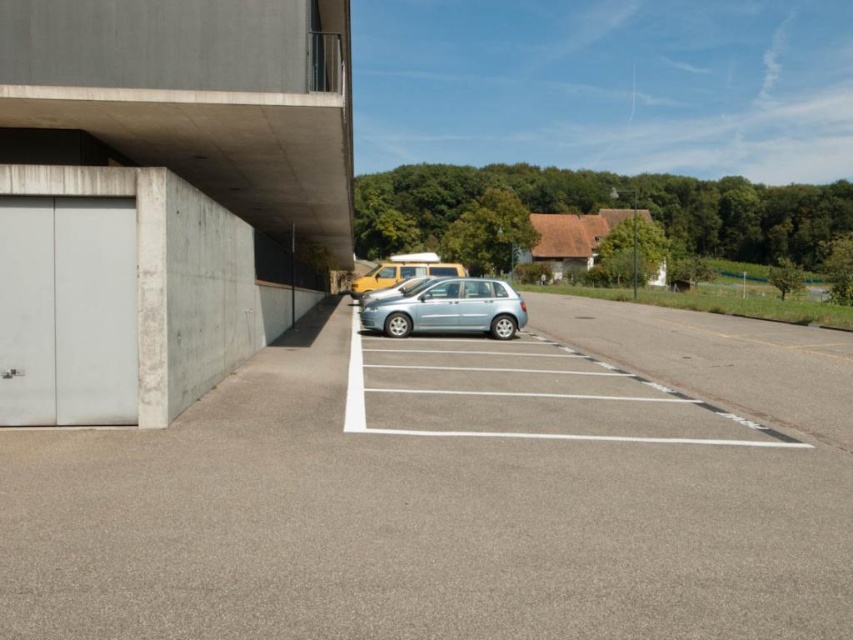
Between metallic yellow van at center and satin silver car at center, which one has more height?

With more height is metallic yellow van at center.

Can you confirm if metallic yellow van at center is taller than satin silver car at center?

Yes, metallic yellow van at center is taller than satin silver car at center.

Who is more distant from viewer, (374, 268) or (363, 292)?

Positioned behind is point (374, 268).

Locate an element on the screen. The height and width of the screenshot is (640, 853). metallic yellow van at center is located at coordinates (403, 272).

Is point (19, 97) closer to viewer compared to point (427, 253)?

Yes.

This screenshot has width=853, height=640. What do you see at coordinates (161, 195) in the screenshot?
I see `concrete at left` at bounding box center [161, 195].

The image size is (853, 640). I want to click on concrete at left, so click(161, 195).

Can you confirm if gray asphalt parking lot at center is positioned below white matte garage door at left?

Yes.

Can you confirm if gray asphalt parking lot at center is positioned to the right of white matte garage door at left?

Correct, you'll find gray asphalt parking lot at center to the right of white matte garage door at left.

Between point (94, 593) and point (96, 289), which one is positioned behind?

The point (96, 289) is behind.

Find the location of a particular element. This screenshot has width=853, height=640. gray asphalt parking lot at center is located at coordinates (457, 490).